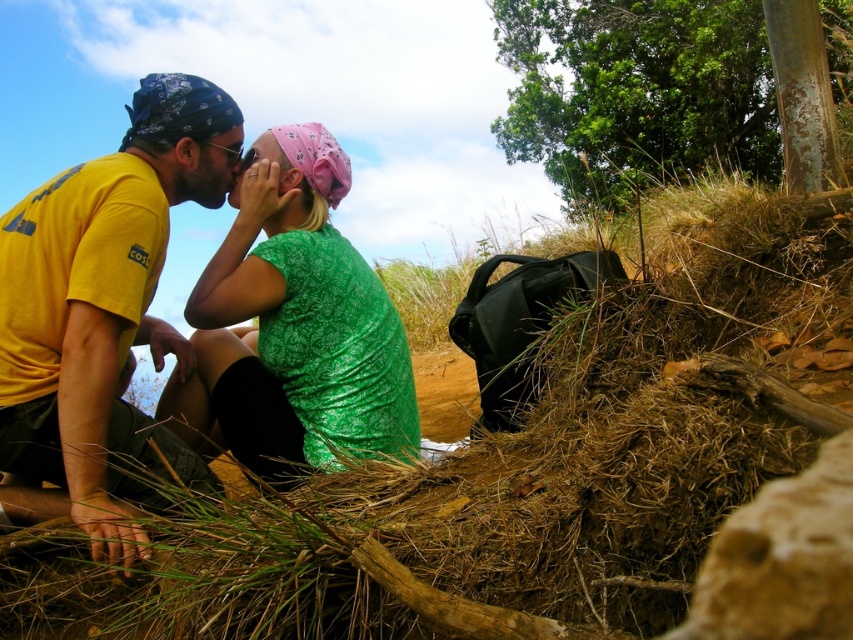
Question: Can you confirm if green textured shirt at center is bigger than pink fabric headscarf at center?

Choices:
 (A) yes
 (B) no

Answer: (A)

Question: Which point is farther from the camera taking this photo?

Choices:
 (A) (100, 353)
 (B) (268, 136)

Answer: (B)

Question: Estimate the real-world distances between objects in this image. Which object is closer to the pink fabric at center?

Choices:
 (A) pink fabric headscarf at center
 (B) yellow matte t-shirt at left
 (C) green textured shirt at center

Answer: (A)

Question: Can you confirm if yellow matte t-shirt at left is thinner than green textured shirt at center?

Choices:
 (A) no
 (B) yes

Answer: (B)

Question: Can you confirm if green textured shirt at center is smaller than pink fabric headscarf at center?

Choices:
 (A) yes
 (B) no

Answer: (B)

Question: Based on their relative distances, which object is farther from the pink fabric headscarf at center?

Choices:
 (A) green textured shirt at center
 (B) yellow matte t-shirt at left
 (C) pink fabric at center

Answer: (B)